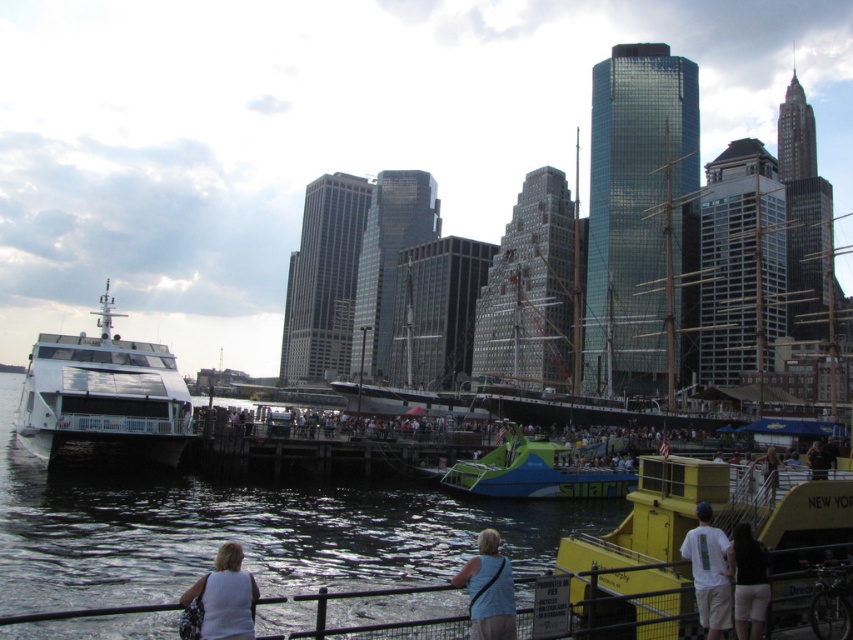
Who is more distant from viewer, (57,442) or (822,449)?

Positioned behind is point (57,442).

Between white glossy boat at left and green fabric shirt at center, which one appears on the right side from the viewer's perspective?

From the viewer's perspective, green fabric shirt at center appears more on the right side.

Between point (100, 376) and point (825, 456), which one is positioned in front?

Point (825, 456)

Identify the location of white glossy boat at left. (103, 396).

Is point (35, 483) positioned after point (24, 419)?

No, (35, 483) is closer to viewer.

Is clear water at dock center below white glossy boat at left?

Yes.

Who is more distant from viewer, (426,577) or (129,396)?

The point (129,396) is more distant.

I want to click on clear water at dock center, so click(x=242, y=531).

Is clear water at dock center smaller than green and blue plastic boat at center?

Incorrect, clear water at dock center is not smaller in size than green and blue plastic boat at center.

Does clear water at dock center have a larger size compared to green and blue plastic boat at center?

Yes, clear water at dock center is bigger than green and blue plastic boat at center.

Locate an element on the screen. This screenshot has width=853, height=640. clear water at dock center is located at coordinates (242, 531).